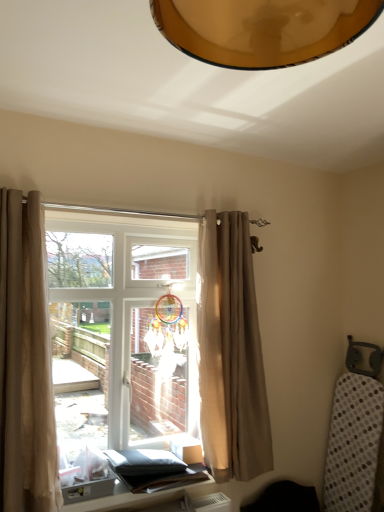
Question: Does beige fabric curtain at left, the first curtain from the front, come in front of beige fabric curtain at center, which ranks as the first curtain in back-to-front order?

Choices:
 (A) no
 (B) yes

Answer: (B)

Question: Does beige fabric curtain at left, the 1th curtain positioned from the left, have a greater height compared to beige fabric curtain at center, which appears as the 1th curtain when viewed from the right?

Choices:
 (A) yes
 (B) no

Answer: (B)

Question: Is beige fabric curtain at left, the 1th curtain positioned from the left, thinner than beige fabric curtain at center, which appears as the 1th curtain when viewed from the right?

Choices:
 (A) yes
 (B) no

Answer: (A)

Question: From a real-world perspective, is beige fabric curtain at left, the 1th curtain positioned from the left, on top of beige fabric curtain at center, which ranks as the first curtain in back-to-front order?

Choices:
 (A) no
 (B) yes

Answer: (A)

Question: Is beige fabric curtain at center, which appears as the 1th curtain when viewed from the right, a part of beige fabric curtain at left, the first curtain from the front?

Choices:
 (A) no
 (B) yes

Answer: (A)

Question: From the image's perspective, is matte black table at lower center located above or below beige fabric curtain at left, the 1th curtain positioned from the left?

Choices:
 (A) above
 (B) below

Answer: (B)

Question: Based on their positions, is matte black table at lower center located to the left or right of beige fabric curtain at left, the first curtain from the front?

Choices:
 (A) right
 (B) left

Answer: (A)

Question: Considering the positions of point (107, 503) and point (16, 321), is point (107, 503) closer or farther from the camera than point (16, 321)?

Choices:
 (A) closer
 (B) farther

Answer: (B)

Question: Looking at the image, does matte black table at lower center seem bigger or smaller compared to beige fabric curtain at left, the first curtain from the front?

Choices:
 (A) big
 (B) small

Answer: (B)

Question: Is beige fabric curtain at left, the 1th curtain positioned from the left, in front of or behind beige fabric curtain at center, which appears as the 1th curtain when viewed from the right, in the image?

Choices:
 (A) front
 (B) behind

Answer: (A)

Question: Is beige fabric curtain at left, the 2th curtain from the back, situated inside beige fabric curtain at center, acting as the 2th curtain starting from the left, or outside?

Choices:
 (A) inside
 (B) outside

Answer: (B)

Question: Considering the positions of beige fabric curtain at left, the 2th curtain from the back, and beige fabric curtain at center, which ranks as the first curtain in back-to-front order, in the image, is beige fabric curtain at left, the 2th curtain from the back, bigger or smaller than beige fabric curtain at center, which ranks as the first curtain in back-to-front order,?

Choices:
 (A) big
 (B) small

Answer: (B)

Question: From a real-world perspective, relative to beige fabric curtain at center, which ranks as the first curtain in back-to-front order, is beige fabric curtain at left, the 2th curtain from the back, vertically above or below?

Choices:
 (A) below
 (B) above

Answer: (A)

Question: From a real-world perspective, is translucent glass window at center above or below beige fabric curtain at center, acting as the 2th curtain starting from the left?

Choices:
 (A) above
 (B) below

Answer: (B)

Question: Based on their positions, is translucent glass window at center located to the left or right of beige fabric curtain at center, acting as the 2th curtain starting from the left?

Choices:
 (A) left
 (B) right

Answer: (A)